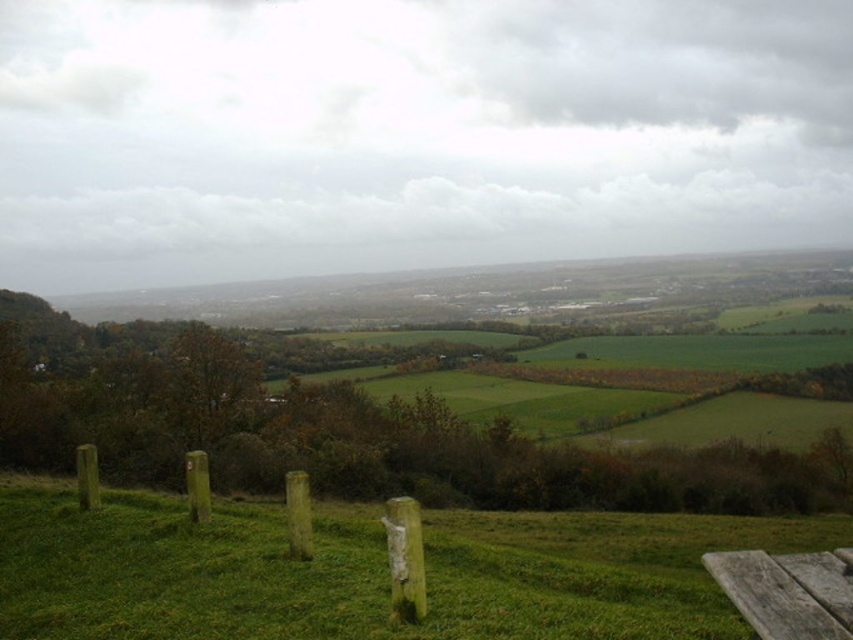
Is green grassy at lower center positioned behind weathered wood bench at lower right?

Yes, it is.

Who is higher up, green grassy at lower center or weathered wood bench at lower right?

Positioned higher is weathered wood bench at lower right.

Where is `green grassy at lower center`? green grassy at lower center is located at coordinates (366, 572).

Identify the location of green grassy at lower center. Image resolution: width=853 pixels, height=640 pixels. (366, 572).

Find the location of a particular element. weathered wood fence at lower center is located at coordinates (405, 557).

Who is positioned more to the left, weathered wood fence at lower center or weathered wood bench at lower right?

Positioned to the left is weathered wood fence at lower center.

Is point (206, 477) positioned in front of point (788, 636)?

No.

Where is `weathered wood fence at lower center`? The image size is (853, 640). weathered wood fence at lower center is located at coordinates (405, 557).

Does green grassy at lower center lie in front of weathered wood fence at lower center?

Yes, it is.

Is green grassy at lower center below weathered wood fence at lower center?

Yes.

This screenshot has width=853, height=640. What do you see at coordinates (366, 572) in the screenshot?
I see `green grassy at lower center` at bounding box center [366, 572].

You are a GUI agent. You are given a task and a screenshot of the screen. Output one action in this format:
    pyautogui.click(x=<x>, y=<y>)
    Task: Click on the green grassy at lower center
    The image size is (853, 640).
    Given the screenshot: What is the action you would take?
    pyautogui.click(x=366, y=572)